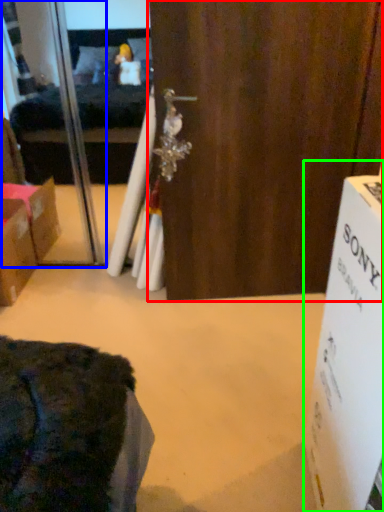
Question: Estimate the real-world distances between objects in this image. Which object is farther from door (highlighted by a red box), screen door (highlighted by a blue box) or cardboard box (highlighted by a green box)?

Choices:
 (A) screen door
 (B) cardboard box

Answer: (B)